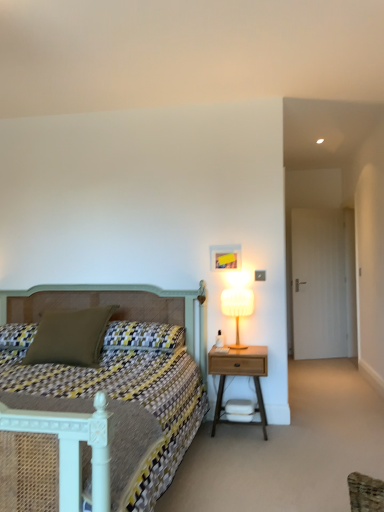
Describe the element at coordinates (90, 426) in the screenshot. I see `patterned fabric bed at center` at that location.

The width and height of the screenshot is (384, 512). What do you see at coordinates (143, 336) in the screenshot?
I see `textured olive green pillow at center-left, positioned as the 1th pillow in right-to-left order` at bounding box center [143, 336].

What do you see at coordinates (70, 337) in the screenshot? The height and width of the screenshot is (512, 384). I see `matte green pillow at left, the first pillow positioned from the left` at bounding box center [70, 337].

Locate an element on the screen. Image resolution: width=384 pixels, height=512 pixels. white fabric lampshade at right is located at coordinates (237, 308).

Locate an element on the screen. The image size is (384, 512). table lamp above the patterned fabric bed at center (from a real-world perspective) is located at coordinates (237, 308).

Is white fabric lampshade at right in contact with patterned fabric bed at center?

No, white fabric lampshade at right is not in contact with patterned fabric bed at center.

From the image's perspective, is white fabric lampshade at right under patterned fabric bed at center?

Actually, white fabric lampshade at right appears above patterned fabric bed at center in the image.

From their relative heights in the image, would you say white fabric lampshade at right is taller or shorter than patterned fabric bed at center?

In the image, white fabric lampshade at right appears to be shorter than patterned fabric bed at center.

In the scene shown: From a real-world perspective, is wooden nightstand at right positioned above or below textured olive green pillow at center-left, positioned as the 1th pillow in right-to-left order?

From a real-world perspective, wooden nightstand at right is physically below textured olive green pillow at center-left, positioned as the 1th pillow in right-to-left order.

The width and height of the screenshot is (384, 512). Find the location of `pillow behind the wooden nightstand at right`. pillow behind the wooden nightstand at right is located at coordinates (143, 336).

Which object is positioned more to the right, wooden nightstand at right or textured olive green pillow at center-left, positioned as the 1th pillow in right-to-left order?

Positioned to the right is wooden nightstand at right.

Is wooden nightstand at right taller or shorter than textured olive green pillow at center-left, which appears as the 2th pillow when viewed from the left?

In the image, wooden nightstand at right appears to be taller than textured olive green pillow at center-left, which appears as the 2th pillow when viewed from the left.

From the image's perspective, which one is positioned lower, white fabric lampshade at right or textured olive green pillow at center-left, positioned as the 1th pillow in right-to-left order?

textured olive green pillow at center-left, positioned as the 1th pillow in right-to-left order, appears lower in the image.

Is white fabric lampshade at right inside or outside of textured olive green pillow at center-left, positioned as the 1th pillow in right-to-left order?

white fabric lampshade at right is spatially situated outside textured olive green pillow at center-left, positioned as the 1th pillow in right-to-left order.

Who is more distant, white fabric lampshade at right or textured olive green pillow at center-left, positioned as the 1th pillow in right-to-left order?

white fabric lampshade at right is further away from the camera.

How distant is white fabric lampshade at right from textured olive green pillow at center-left, which appears as the 2th pillow when viewed from the left?

white fabric lampshade at right and textured olive green pillow at center-left, which appears as the 2th pillow when viewed from the left, are 24.67 inches apart.

Is patterned fabric bed at center taller than wooden nightstand at right?

Yes, patterned fabric bed at center is taller than wooden nightstand at right.

Is patterned fabric bed at center positioned behind wooden nightstand at right?

No, patterned fabric bed at center is closer to the viewer.

Locate an element on the screen. This screenshot has width=384, height=512. nightstand below the patterned fabric bed at center (from the image's perspective) is located at coordinates (239, 375).

Would you say wooden nightstand at right is a long distance from patterned fabric bed at center?

No, wooden nightstand at right is not far away from patterned fabric bed at center.

Where is `nightstand that appears below the patterned fabric bed at center (from the image's perspective)`? The image size is (384, 512). nightstand that appears below the patterned fabric bed at center (from the image's perspective) is located at coordinates (239, 375).

From a real-world perspective, is wooden nightstand at right physically below patterned fabric bed at center?

Yes, from a real-world perspective, wooden nightstand at right is beneath patterned fabric bed at center.

Between point (267, 361) and point (11, 447), which one is positioned in front?

The point (11, 447) is closer.

Does white fabric lampshade at right have a lesser width compared to matte green pillow at left, the second pillow positioned from the right?

Correct, the width of white fabric lampshade at right is less than that of matte green pillow at left, the second pillow positioned from the right.

Considering the sizes of objects white fabric lampshade at right and matte green pillow at left, the first pillow positioned from the left, in the image provided, who is shorter, white fabric lampshade at right or matte green pillow at left, the first pillow positioned from the left,?

matte green pillow at left, the first pillow positioned from the left, is shorter.

Considering the positions of objects white fabric lampshade at right and matte green pillow at left, the second pillow positioned from the right, in the image provided, who is in front, white fabric lampshade at right or matte green pillow at left, the second pillow positioned from the right,?

matte green pillow at left, the second pillow positioned from the right, is closer to the camera.

Is point (242, 347) farther from viewer compared to point (25, 357)?

Yes, it is behind point (25, 357).

Is wooden nightstand at right smaller than white fabric lampshade at right?

No.

Is wooden nightstand at right aimed at white fabric lampshade at right?

No, wooden nightstand at right is not turned towards white fabric lampshade at right.

At what (x,y) coordinates should I click in order to perform the action: click on nightstand that appears in front of the white fabric lampshade at right. Please return your answer as a coordinate pair (x, y). Looking at the image, I should click on [239, 375].

Consider the image. From the image's perspective, which is below, wooden nightstand at right or white fabric lampshade at right?

From the image's view, wooden nightstand at right is below.

Locate an element on the screen. The width and height of the screenshot is (384, 512). table lamp above the patterned fabric bed at center (from the image's perspective) is located at coordinates (237, 308).

The width and height of the screenshot is (384, 512). There is a wooden nightstand at right. Find the location of `the 1st pillow above it (from a real-world perspective)`. the 1st pillow above it (from a real-world perspective) is located at coordinates (143, 336).

Which object lies further to the anchor point textured olive green pillow at center-left, positioned as the 1th pillow in right-to-left order, white fabric lampshade at right or matte green pillow at left, the first pillow positioned from the left?

The object further to textured olive green pillow at center-left, positioned as the 1th pillow in right-to-left order, is white fabric lampshade at right.

Estimate the real-world distances between objects in this image. Which object is closer to matte green pillow at left, the first pillow positioned from the left, wooden nightstand at right or white fabric lampshade at right?

The object closer to matte green pillow at left, the first pillow positioned from the left, is wooden nightstand at right.

Looking at the image, which one is located further to patterned fabric bed at center, textured olive green pillow at center-left, positioned as the 1th pillow in right-to-left order, or matte green pillow at left, the first pillow positioned from the left?

The object further to patterned fabric bed at center is matte green pillow at left, the first pillow positioned from the left.

Looking at the image, which one is located closer to textured olive green pillow at center-left, positioned as the 1th pillow in right-to-left order, wooden nightstand at right or matte green pillow at left, the first pillow positioned from the left?

Based on the image, matte green pillow at left, the first pillow positioned from the left, appears to be nearer to textured olive green pillow at center-left, positioned as the 1th pillow in right-to-left order.

From the image, which object appears to be farther from matte green pillow at left, the second pillow positioned from the right, white fabric lampshade at right or textured olive green pillow at center-left, which appears as the 2th pillow when viewed from the left?

white fabric lampshade at right is further to matte green pillow at left, the second pillow positioned from the right.

From the image, which object appears to be farther from white fabric lampshade at right, patterned fabric bed at center or wooden nightstand at right?

patterned fabric bed at center is further to white fabric lampshade at right.

When comparing their distances from white fabric lampshade at right, does patterned fabric bed at center or textured olive green pillow at center-left, positioned as the 1th pillow in right-to-left order, seem further?

Based on the image, patterned fabric bed at center appears to be further to white fabric lampshade at right.

Based on their spatial positions, is patterned fabric bed at center or textured olive green pillow at center-left, which appears as the 2th pillow when viewed from the left, closer to matte green pillow at left, the second pillow positioned from the right?

textured olive green pillow at center-left, which appears as the 2th pillow when viewed from the left, is positioned closer to the anchor matte green pillow at left, the second pillow positioned from the right.

Identify the location of table lamp situated between textured olive green pillow at center-left, which appears as the 2th pillow when viewed from the left, and wooden nightstand at right from left to right. The height and width of the screenshot is (512, 384). (237, 308).

The image size is (384, 512). Identify the location of pillow between matte green pillow at left, the first pillow positioned from the left, and white fabric lampshade at right. (143, 336).

This screenshot has width=384, height=512. In order to click on pillow between patterned fabric bed at center and wooden nightstand at right along the z-axis in this screenshot , I will do `click(70, 337)`.

Identify the location of table lamp between matte green pillow at left, the first pillow positioned from the left, and wooden nightstand at right from left to right. Image resolution: width=384 pixels, height=512 pixels. (237, 308).